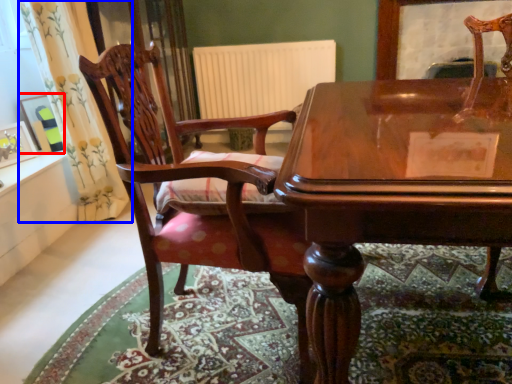
Question: Which object appears closest to the camera in this image, picture frame (highlighted by a red box) or curtain (highlighted by a blue box)?

Choices:
 (A) picture frame
 (B) curtain

Answer: (B)